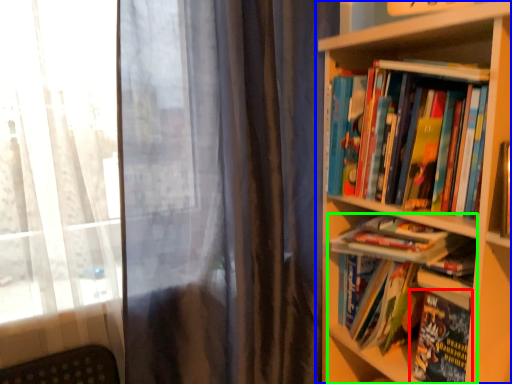
Question: Which is farther away from book (highlighted by a red box)? bookcase (highlighted by a blue box) or book (highlighted by a green box)?

Choices:
 (A) bookcase
 (B) book

Answer: (A)